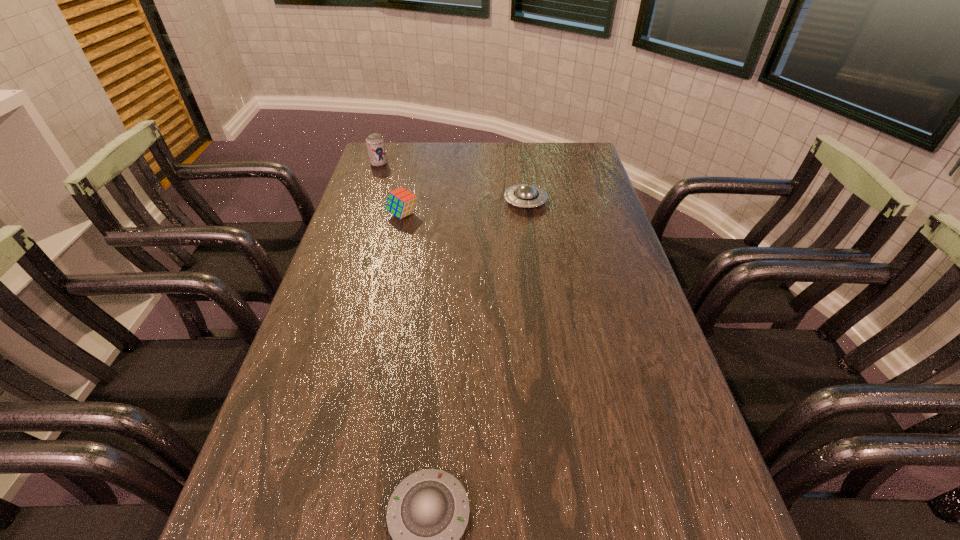
Identify the location of the tallest object. (375, 144).

Locate an element on the screen. the farthest object is located at coordinates (375, 144).

I want to click on the third shortest object, so click(400, 202).

The image size is (960, 540). Identify the location of the second object from left to right. (400, 202).

Identify the location of the taller saucer. This screenshot has height=540, width=960. (525, 195).

In order to click on the farther saucer in this screenshot , I will do `click(525, 195)`.

You are a GUI agent. You are given a task and a screenshot of the screen. Output one action in this format:
    pyautogui.click(x=<x>, y=<y>)
    Task: Click on the free space located 0.120m on the front of the beer can
    Image resolution: width=960 pixels, height=540 pixels.
    Given the screenshot: What is the action you would take?
    pyautogui.click(x=372, y=186)

Identify the location of free location located on the front of the third shortest object. point(384,298).

Where is `free region located on the back of the taller saucer`? This screenshot has width=960, height=540. free region located on the back of the taller saucer is located at coordinates (518, 147).

Find the location of `object present at the far edge`. object present at the far edge is located at coordinates (375, 144).